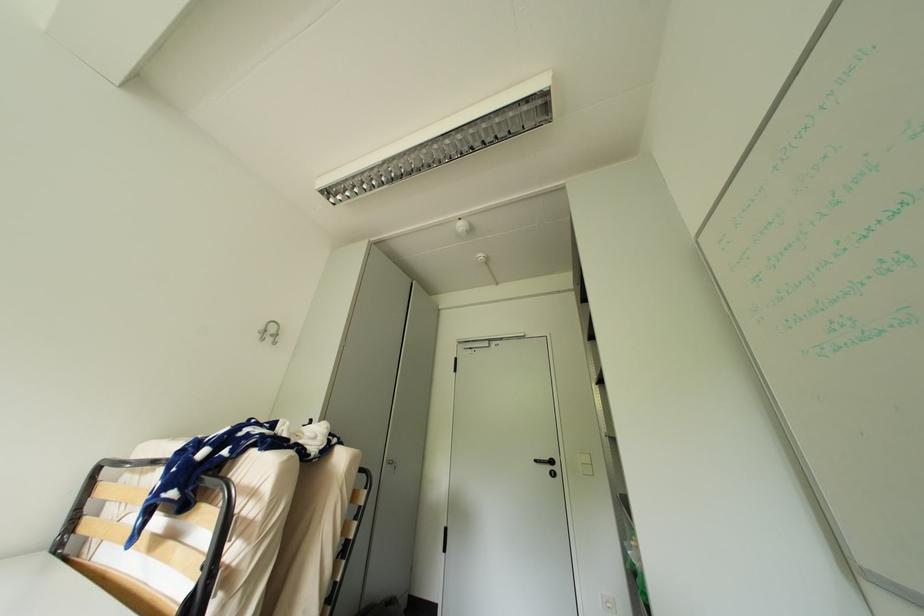
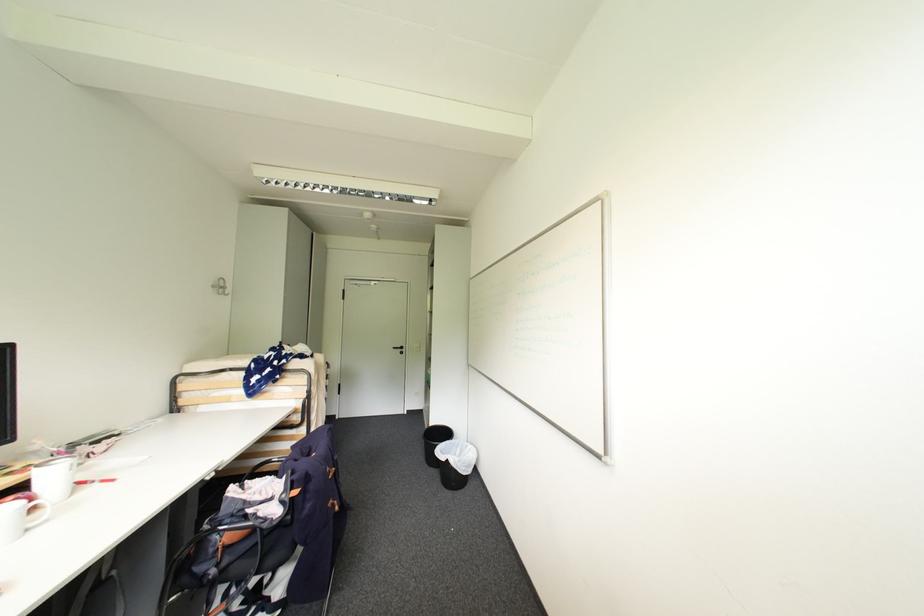
The point at [542,462] is marked in the first image. Where is the corresponding point in the second image?

(400, 349)